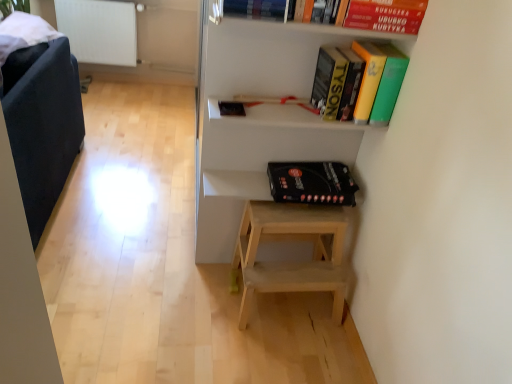
Question: In terms of width, does red matte paperback book at upper right, the 2th paperback book when ordered from bottom to top, look wider or thinner when compared to white matte shelf at upper center?

Choices:
 (A) wide
 (B) thin

Answer: (B)

Question: Considering the positions of red matte paperback book at upper right, the 2th paperback book when ordered from bottom to top, and white matte shelf at upper center in the image, is red matte paperback book at upper right, the 2th paperback book when ordered from bottom to top, bigger or smaller than white matte shelf at upper center?

Choices:
 (A) small
 (B) big

Answer: (A)

Question: Considering the real-world distances, which object is farthest from the hardcover book at upper center, acting as the 2th book starting from the bottom?

Choices:
 (A) yellow matte book at upper center, the first book from the right
 (B) black matte board game at center, which is counted as the 2th paperback book, starting from the front
 (C) white matte shelf at upper center
 (D) red matte paperback book at upper right, the 1th paperback book positioned from the front
 (E) dark blue fabric armchair at left

Answer: (E)

Question: Based on their relative distances, which object is farther from the red matte paperback book at upper right, the 1th paperback book when ordered from top to bottom?

Choices:
 (A) hardcover book at upper center, placed as the first book when sorted from top to bottom
 (B) black matte board game at center, the 1th paperback book in the bottom-to-top sequence
 (C) yellow matte book at upper center, the 1th book when ordered from bottom to top
 (D) white matte shelf at upper center
 (E) dark blue fabric armchair at left

Answer: (E)